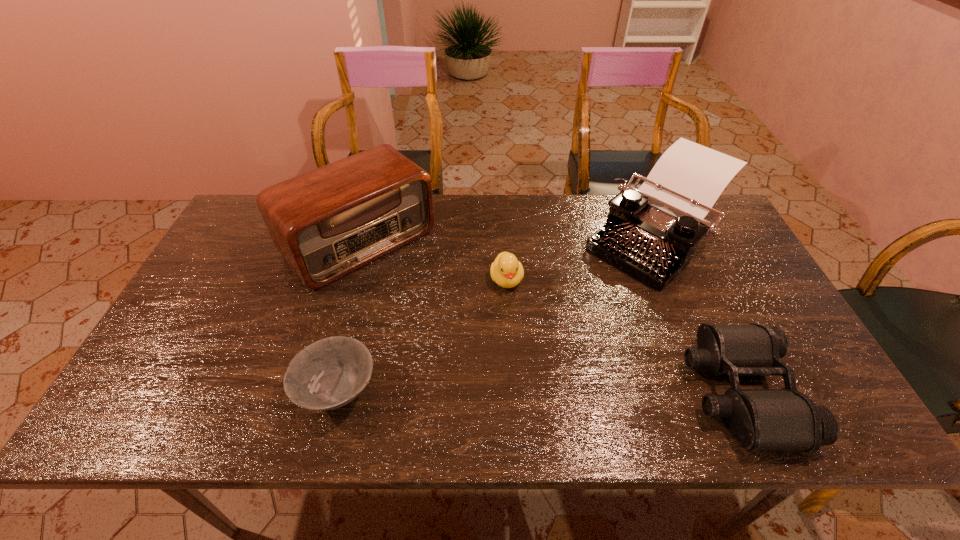
Find the location of `bowl situated at the near edge`. bowl situated at the near edge is located at coordinates point(327,374).

At what (x,y) coordinates should I click in order to perform the action: click on binoculars positioned at the near edge. Please return your answer as a coordinate pair (x, y). Looking at the image, I should click on (760, 419).

Where is `binoculars that is at the right edge`? binoculars that is at the right edge is located at coordinates (760, 419).

Where is `typewriter present at the right edge`? The width and height of the screenshot is (960, 540). typewriter present at the right edge is located at coordinates (651, 233).

The image size is (960, 540). I want to click on object positioned at the far right corner, so click(x=651, y=233).

You are a GUI agent. You are given a task and a screenshot of the screen. Output one action in this format:
    pyautogui.click(x=<x>, y=<y>)
    Task: Click on the object present at the near right corner
    This screenshot has height=540, width=960.
    Given the screenshot: What is the action you would take?
    pyautogui.click(x=760, y=419)

Image resolution: width=960 pixels, height=540 pixels. Identify the location of blank area at the far edge. (539, 194).

The height and width of the screenshot is (540, 960). Identify the location of blank space at the near edge of the desktop. (273, 390).

Identify the location of vacant region at the left edge of the desktop. The width and height of the screenshot is (960, 540). (199, 313).

In the image, there is a desktop. At what (x,y) coordinates should I click in order to perform the action: click on vacant space at the right edge. Please return your answer as a coordinate pair (x, y). The height and width of the screenshot is (540, 960). Looking at the image, I should click on (790, 348).